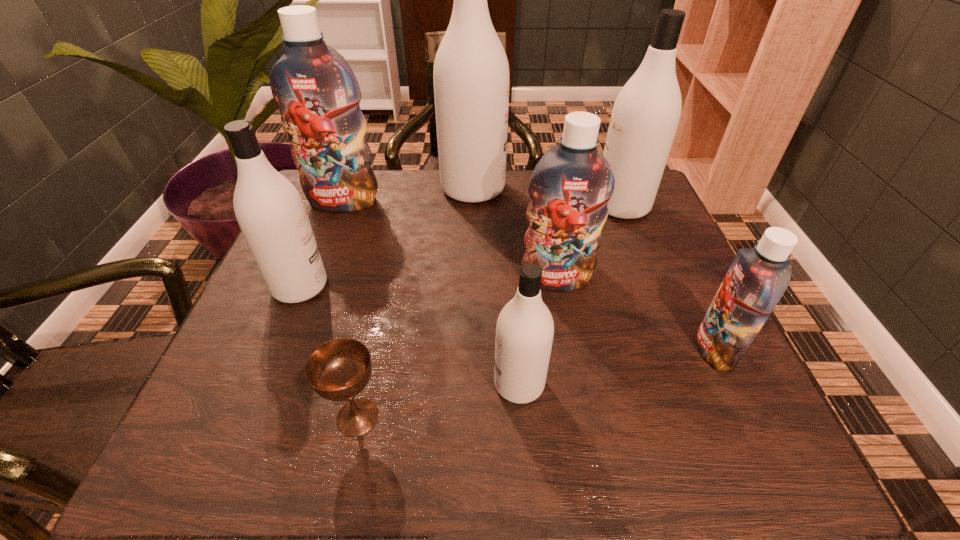
You are a GUI agent. You are given a task and a screenshot of the screen. Output one action in this format:
    pyautogui.click(x=<x>, y=<y>)
    Task: Click on the vacant region between the smallest white shampoo and the third farthest white shampoo
    Image resolution: width=960 pixels, height=540 pixels.
    Given the screenshot: What is the action you would take?
    pyautogui.click(x=410, y=335)

Identify the location of free area in between the tallest shampoo and the second blue shampoo from left to right. tap(515, 234).

Identify the location of free space between the leftmost white shampoo and the rightmost white shampoo. This screenshot has width=960, height=540. (461, 246).

Identify which object is the fifth nearest to the tallest shampoo. Please provide its 2D coordinates. Your answer should be formatted as a tuple, i.e. [(x, y)], where the tuple contains the x and y coordinates of a point satisfying the conditions above.

[(524, 334)]

What are the coordinates of `the fourth closest object to the smallest white shampoo` in the screenshot? It's located at (271, 214).

Where is `shampoo object that ranks as the fifth closest to the tallest shampoo`? The image size is (960, 540). shampoo object that ranks as the fifth closest to the tallest shampoo is located at coordinates [x=524, y=334].

Locate which shampoo ranks second in proximity to the chalice. Please provide its 2D coordinates. Your answer should be formatted as a tuple, i.e. [(x, y)], where the tuple contains the x and y coordinates of a point satisfying the conditions above.

[(271, 214)]

Select which white shampoo appears as the second closest to the rightmost white shampoo. Please provide its 2D coordinates. Your answer should be formatted as a tuple, i.e. [(x, y)], where the tuple contains the x and y coordinates of a point satisfying the conditions above.

[(524, 334)]

You are a GUI agent. You are given a task and a screenshot of the screen. Output one action in this format:
    pyautogui.click(x=<x>, y=<y>)
    Task: Click on the white shampoo that is the third closest to the biggest white shampoo
    The image size is (960, 540).
    Given the screenshot: What is the action you would take?
    pyautogui.click(x=524, y=334)

Choose which blue shampoo is the third nearest neighbor to the second smallest white shampoo. Please provide its 2D coordinates. Your answer should be formatted as a tuple, i.e. [(x, y)], where the tuple contains the x and y coordinates of a point satisfying the conditions above.

[(757, 278)]